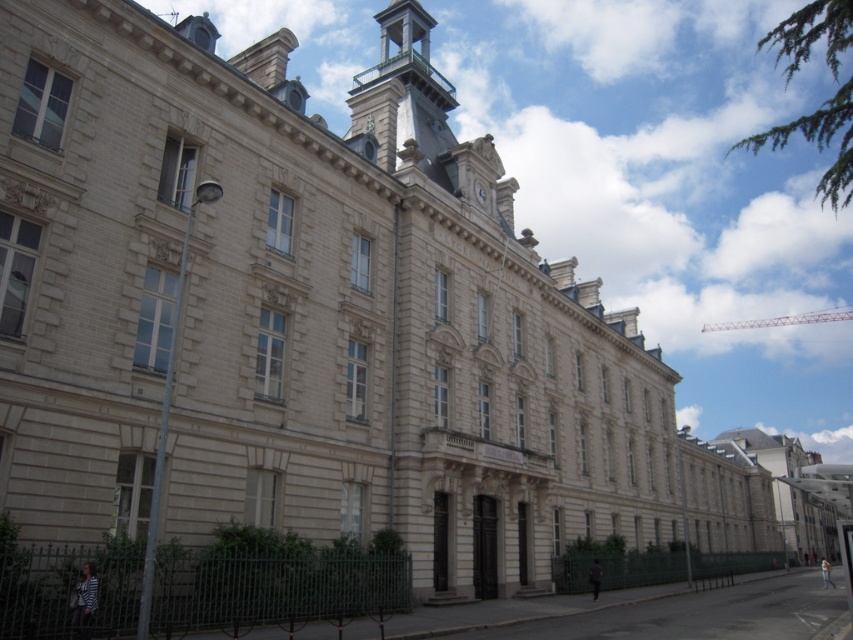
Which is in front, point (364, 80) or point (485, 195)?

Positioned in front is point (485, 195).

Does polished brass bell tower at upper center have a lesser width compared to white stone clock at upper center?

Incorrect, polished brass bell tower at upper center's width is not less than white stone clock at upper center's.

Is point (398, 77) positioned behind point (479, 184)?

That is True.

The width and height of the screenshot is (853, 640). I want to click on polished brass bell tower at upper center, so click(412, 80).